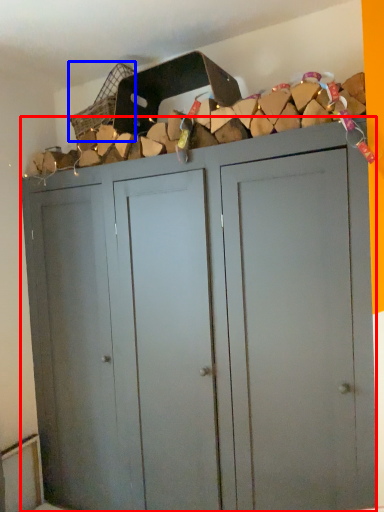
Question: Which point is further to the camera, cupboard (highlighted by a red box) or basket (highlighted by a blue box)?

Choices:
 (A) cupboard
 (B) basket

Answer: (B)